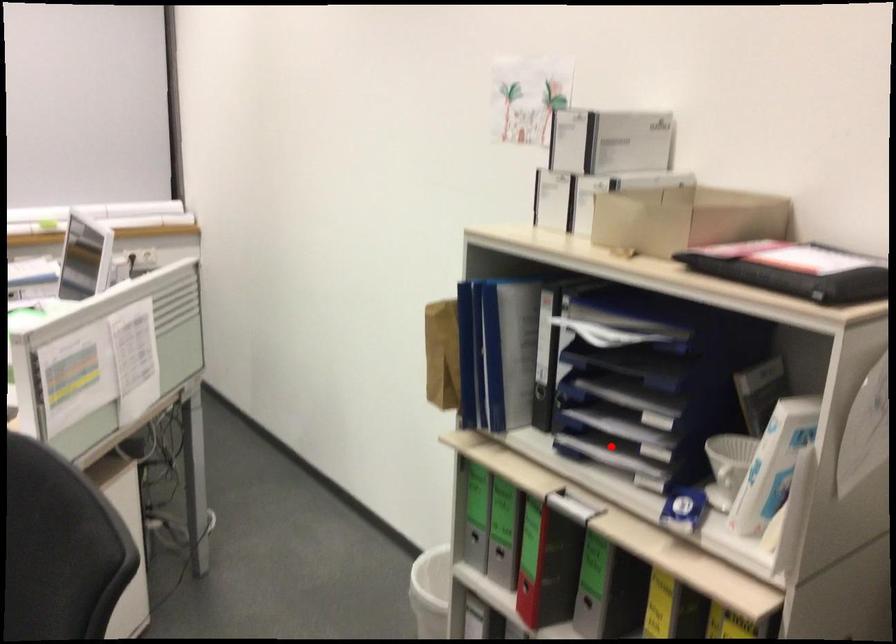
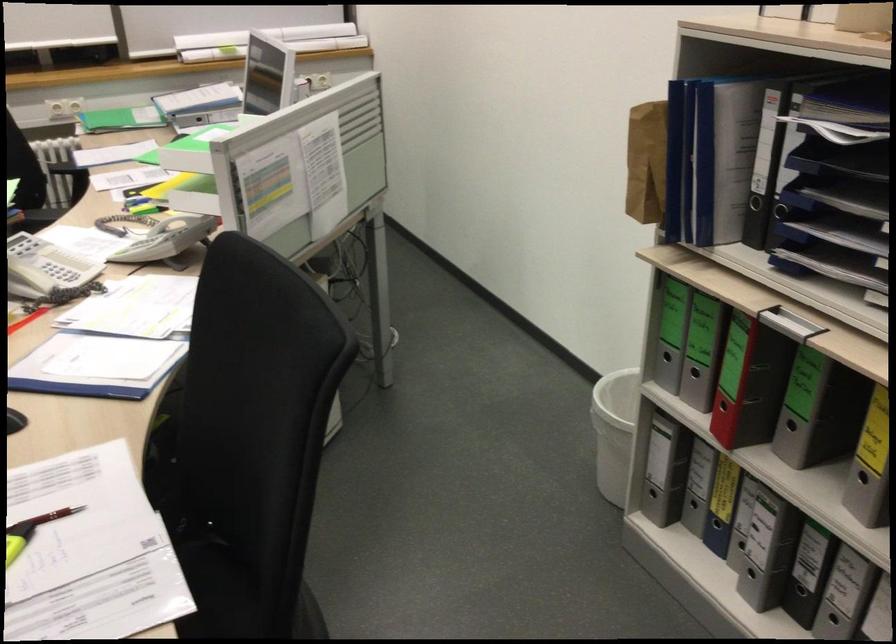
Question: A red point is marked in image1. In image2, is the corresponding 3D point closer to the camera or farther? Reply with the corresponding letter.

Choices:
 (A) The corresponding 3D point is closer.
 (B) The corresponding 3D point is farther.

Answer: (A)